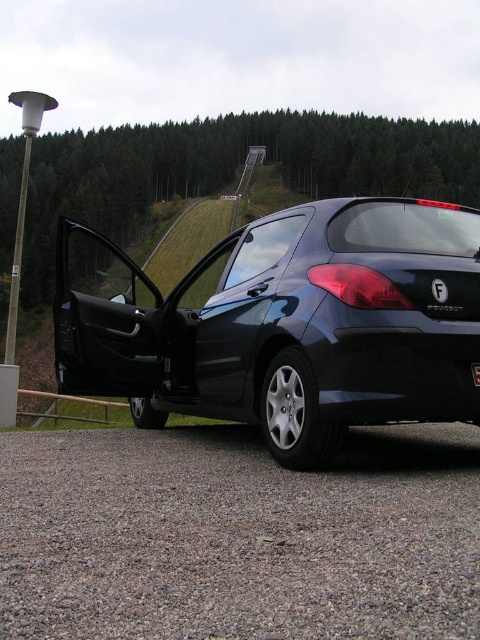
Which of these two, glossy dark blue hatchback at center or black plastic license plate at center, stands taller?

With more height is glossy dark blue hatchback at center.

Looking at this image, how distant is glossy dark blue hatchback at center from black plastic license plate at center?

glossy dark blue hatchback at center is 40.87 meters from black plastic license plate at center.

Which is in front, point (164, 320) or point (476, 372)?

Point (476, 372) is in front.

The image size is (480, 640). Identify the location of glossy dark blue hatchback at center. (285, 323).